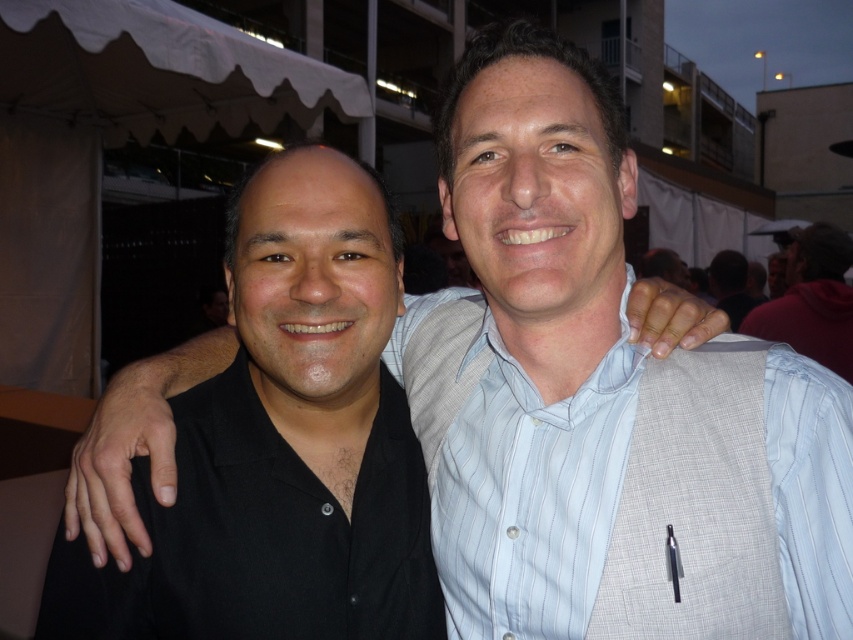
You are at a social event and want to find the light blue striped shirt at center and the white striped shirt at upper right. Which one is closer to the camera?

The light blue striped shirt at center is smaller than the white striped shirt at upper right, so it is closer to the camera.

From the picture: You are holding a 70 cm long measuring tape and want to measure the distance from the camera to the point at coordinates point (444, 492). Can you reach it with your measuring tape?

The point (444, 492) is 84.09 centimeters from the camera. Since the measuring tape is only 70 cm long, you cannot reach it with the measuring tape.